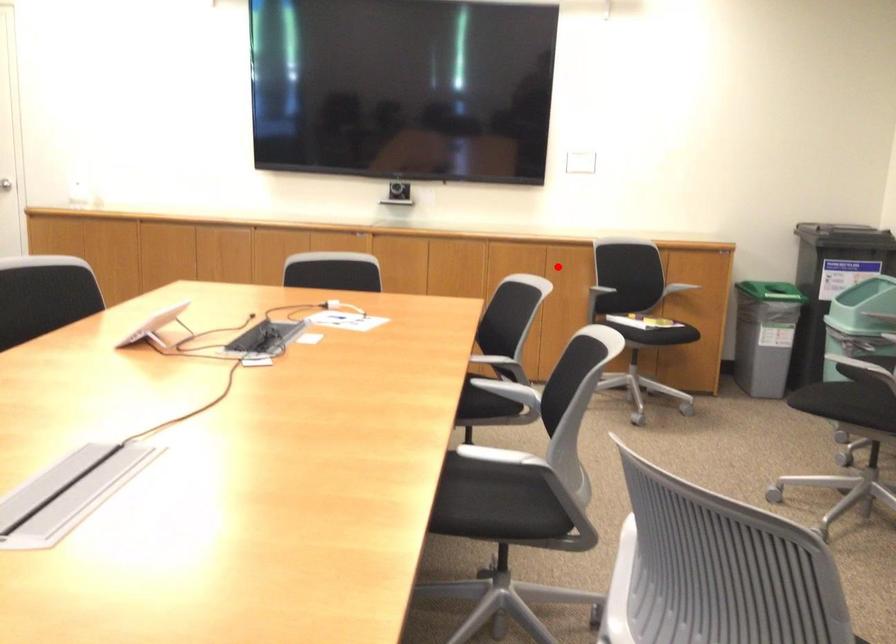
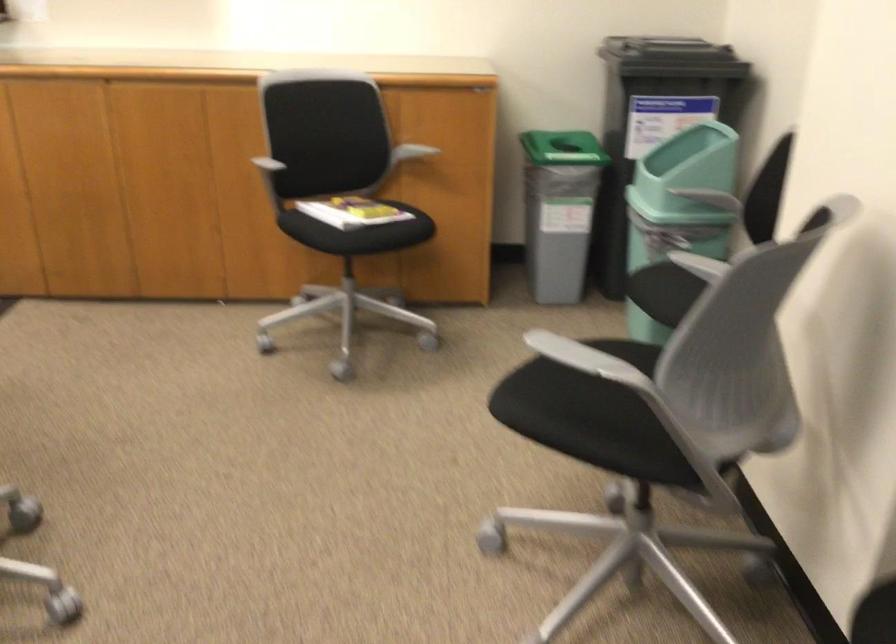
Question: A red point is marked in image1. In image2, is the corresponding 3D point closer to the camera or farther? Reply with the corresponding letter.

Choices:
 (A) The corresponding 3D point is closer.
 (B) The corresponding 3D point is farther.

Answer: (A)